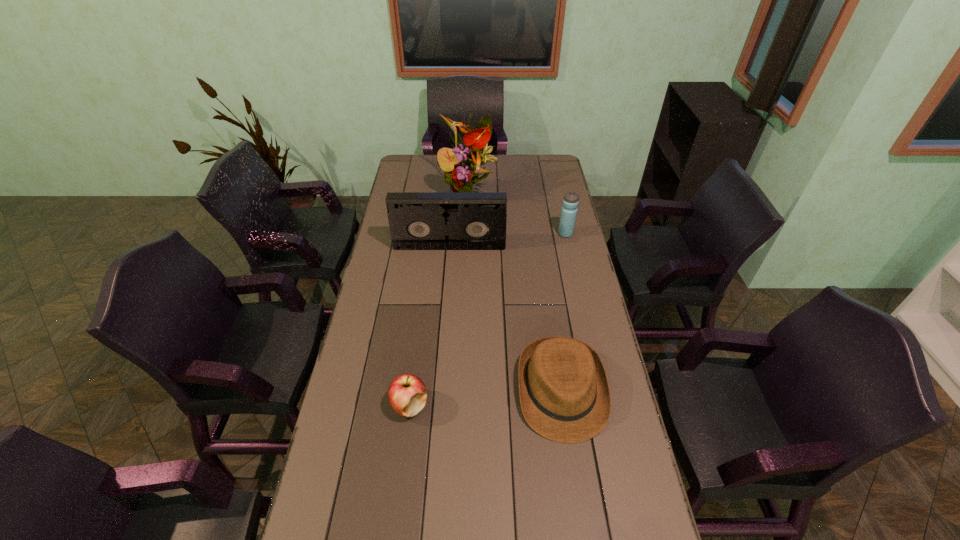
Locate an element on the screen. Image resolution: width=960 pixels, height=540 pixels. vacant space located 0.210m on the back of the water bottle is located at coordinates (558, 201).

The height and width of the screenshot is (540, 960). In order to click on vacant space located on the front of the apple in this screenshot , I will do `click(394, 533)`.

Locate an element on the screen. The width and height of the screenshot is (960, 540). vacant region located on the front-facing side of the fedora is located at coordinates (574, 477).

Image resolution: width=960 pixels, height=540 pixels. What are the coordinates of `object situated at the far edge` in the screenshot? It's located at (462, 165).

At what (x,y) coordinates should I click in order to perform the action: click on videotape that is at the left edge. Please return your answer as a coordinate pair (x, y). The height and width of the screenshot is (540, 960). Looking at the image, I should click on (417, 220).

Locate an element on the screen. apple present at the left edge is located at coordinates (407, 394).

I want to click on water bottle that is at the right edge, so click(570, 202).

Where is `fedora that is at the right edge`? This screenshot has width=960, height=540. fedora that is at the right edge is located at coordinates [x=564, y=393].

The width and height of the screenshot is (960, 540). Identify the location of vacant space at the left edge of the desktop. (397, 258).

What are the coordinates of `free space at the right edge of the desktop` in the screenshot? It's located at (598, 503).